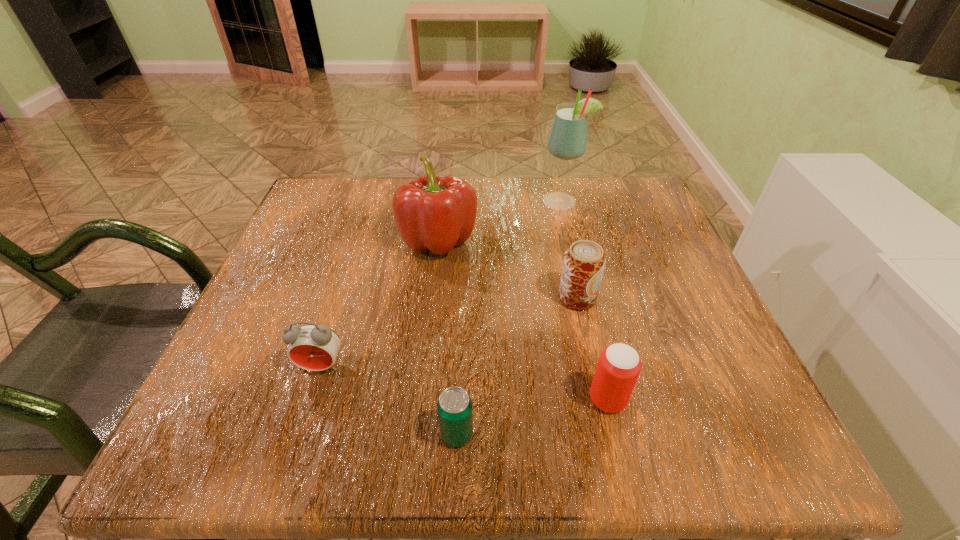
This screenshot has width=960, height=540. I want to click on blank area in the image that satisfies the following two spatial constraints: 1. on the face of the second nearest beer can; 2. on the right side of the fourth farthest object, so click(x=311, y=400).